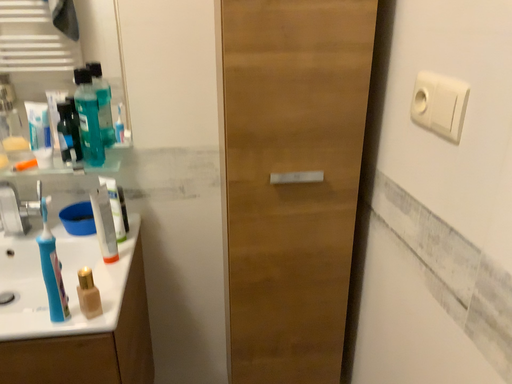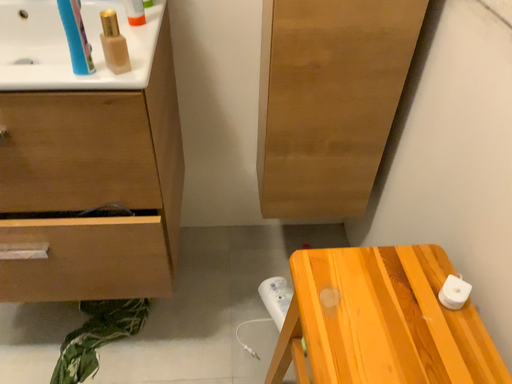
Question: Which way did the camera rotate in the video?

Choices:
 (A) rotated downward
 (B) rotated upward

Answer: (A)